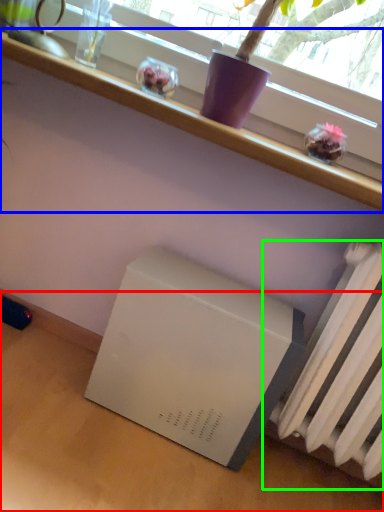
Question: Based on their relative distances, which object is nearer to table (highlighted by a red box)? Choose from furniture (highlighted by a blue box) and radiator (highlighted by a green box).

Choices:
 (A) furniture
 (B) radiator

Answer: (B)